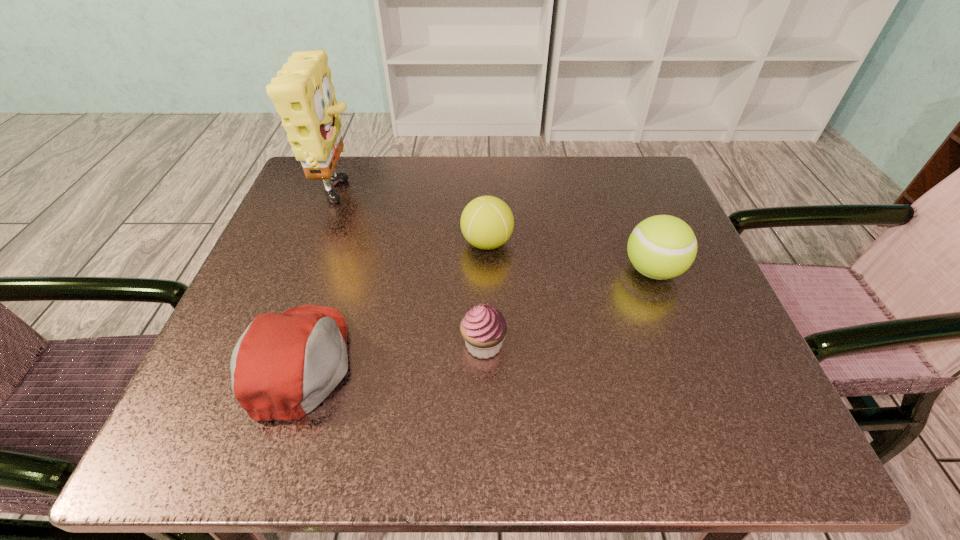
The image size is (960, 540). Identify the location of object located at the far edge. (302, 92).

Where is `object that is at the near edge`? The height and width of the screenshot is (540, 960). object that is at the near edge is located at coordinates (284, 365).

This screenshot has height=540, width=960. What are the coordinates of `sponge at the left edge` in the screenshot? It's located at (302, 92).

At what (x,y) coordinates should I click in order to perform the action: click on cap that is at the left edge. Please return your answer as a coordinate pair (x, y). Image resolution: width=960 pixels, height=540 pixels. Looking at the image, I should click on (284, 365).

This screenshot has width=960, height=540. What are the coordinates of `object at the right edge` in the screenshot? It's located at (661, 247).

Where is `object present at the far left corner`? The height and width of the screenshot is (540, 960). object present at the far left corner is located at coordinates (302, 92).

Locate an element on the screen. The width and height of the screenshot is (960, 540). object that is positioned at the near left corner is located at coordinates (284, 365).

Image resolution: width=960 pixels, height=540 pixels. What are the coordinates of `vacant space at the far edge of the desktop` in the screenshot? It's located at (414, 211).

In the image, there is a desktop. Find the location of `free space at the near edge`. free space at the near edge is located at coordinates (501, 413).

Image resolution: width=960 pixels, height=540 pixels. Identify the location of vacant space at the left edge of the desktop. (338, 222).